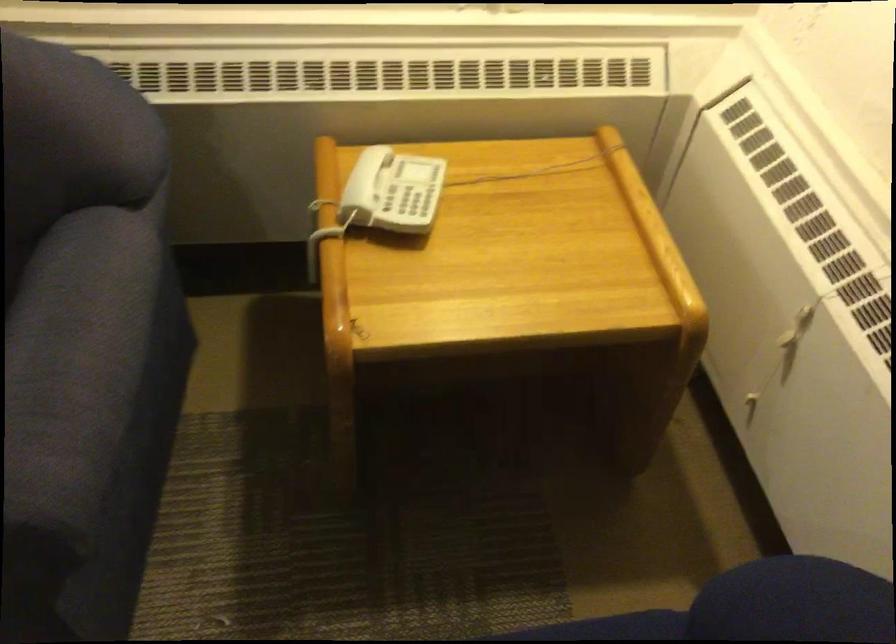
Where would you press the telephone button? Please return your answer as a coordinate pair (x, y).

(414, 200)